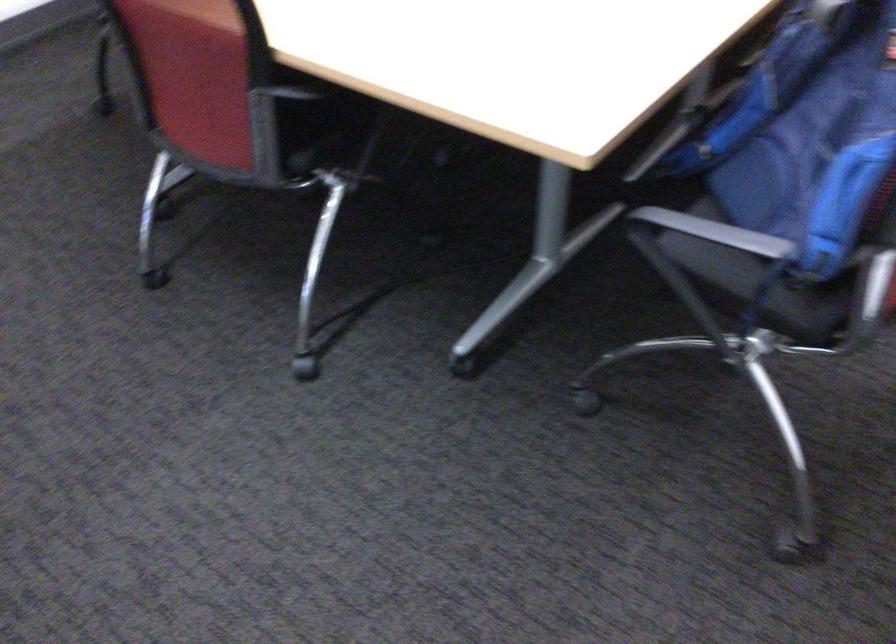
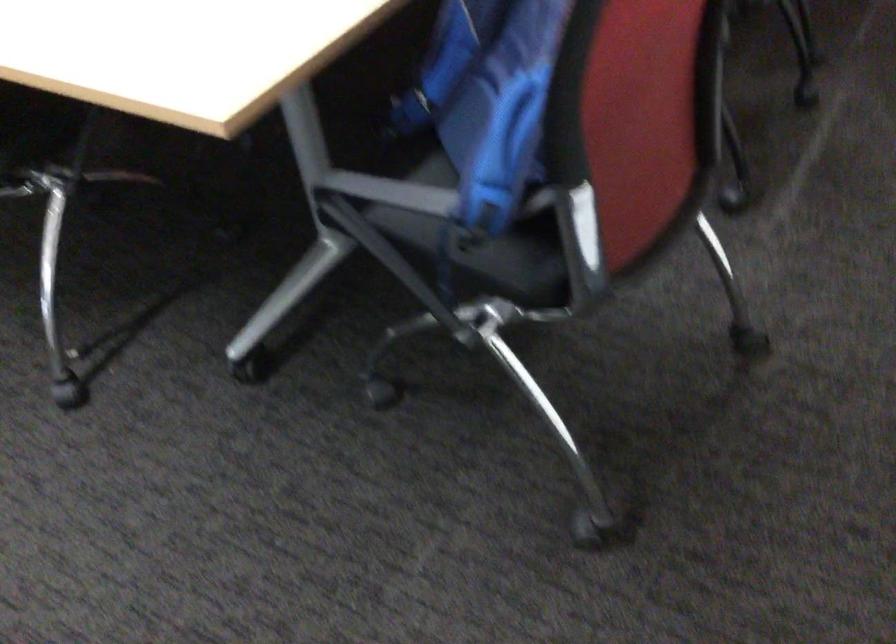
Where in the second image is the point corresponding to [774,158] from the first image?

(487, 98)